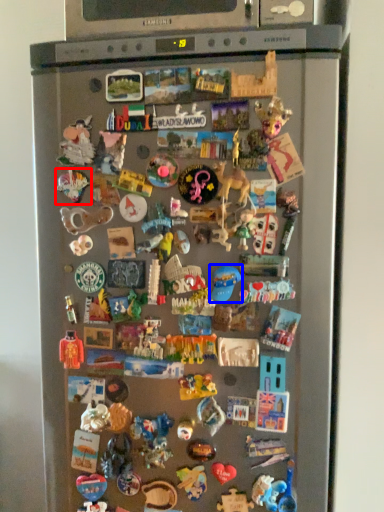
Question: Which object appears closest to the camera in this image, toy (highlighted by a red box) or toy (highlighted by a blue box)?

Choices:
 (A) toy
 (B) toy

Answer: (B)